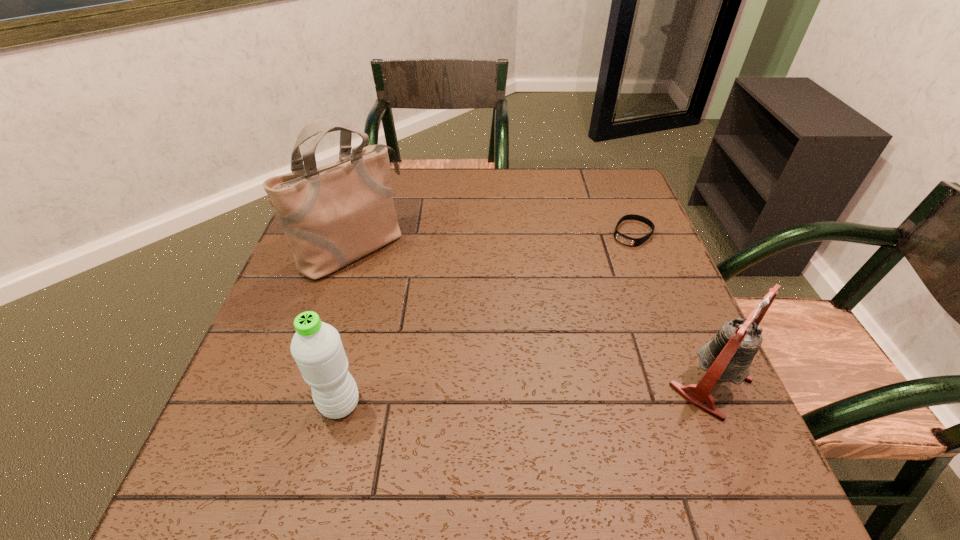
The image size is (960, 540). What are the coordinates of `free area in between the water bottle and the tallest object` in the screenshot? It's located at (347, 326).

Where is `free space between the shoulder bag and the bell`? free space between the shoulder bag and the bell is located at coordinates [532, 316].

Identify the location of empty space between the bell and the tallest object. The height and width of the screenshot is (540, 960). (532, 316).

What are the coordinates of `vacant area that lies between the tallest object and the wristband` in the screenshot? It's located at (492, 241).

Locate which object is the closest to the tallest object. Please provide its 2D coordinates. Your answer should be formatted as a tuple, i.e. [(x, y)], where the tuple contains the x and y coordinates of a point satisfying the conditions above.

[(317, 348)]

Identify which object is located as the second nearest to the bell. Please provide its 2D coordinates. Your answer should be formatted as a tuple, i.e. [(x, y)], where the tuple contains the x and y coordinates of a point satisfying the conditions above.

[(317, 348)]

Where is `vacant space that satisfies the following two spatial constraints: 1. on the front side of the shoulder bag; 2. on the right side of the water bottle`? The height and width of the screenshot is (540, 960). vacant space that satisfies the following two spatial constraints: 1. on the front side of the shoulder bag; 2. on the right side of the water bottle is located at coordinates (302, 404).

Find the location of a particular element. This screenshot has width=960, height=540. vacant point that satisfies the following two spatial constraints: 1. on the back side of the tallest object; 2. on the left side of the shortest object is located at coordinates (357, 234).